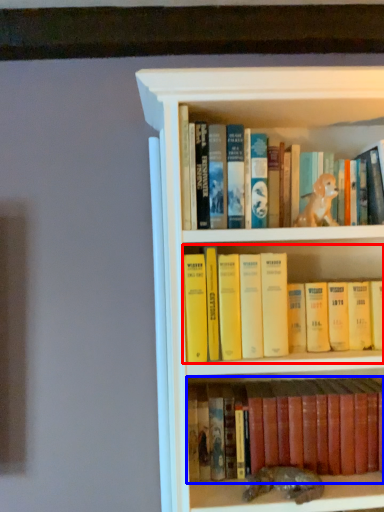
Question: Among these objects, which one is nearest to the camera, book (highlighted by a red box) or book (highlighted by a blue box)?

Choices:
 (A) book
 (B) book

Answer: (A)